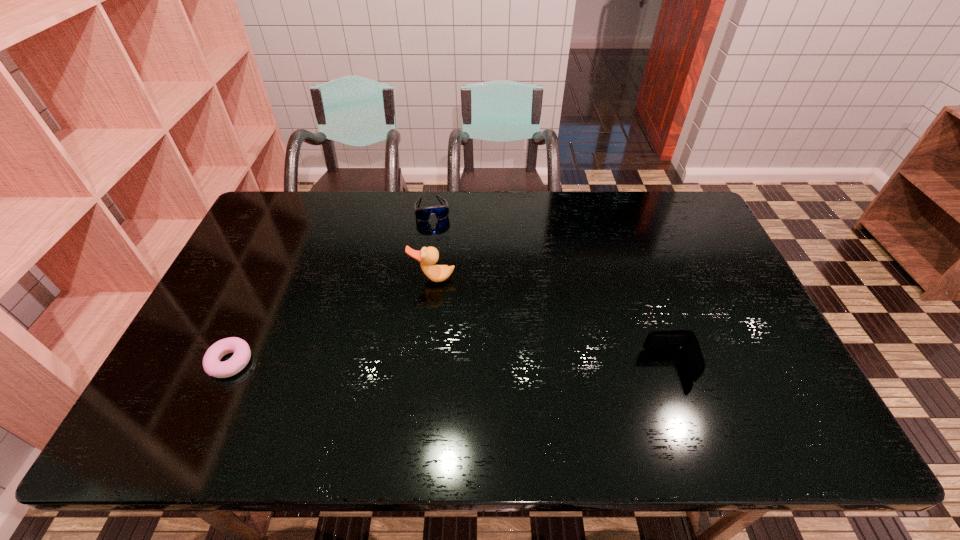
I want to click on free space on the desktop that is between the pastry and the second tallest object and is positioned on the beak of the tallest object, so tap(422, 363).

This screenshot has width=960, height=540. Identify the location of vacant space on the desktop that is between the shortest object and the wallet and is positioned on the front-facing side of the third tallest object. (460, 364).